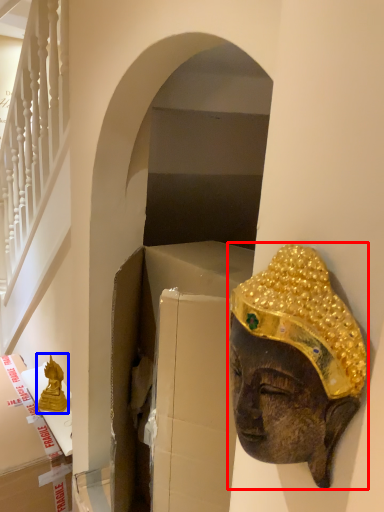
Question: Which object is further to the camera taking this photo, person (highlighted by a red box) or statue (highlighted by a blue box)?

Choices:
 (A) person
 (B) statue

Answer: (B)